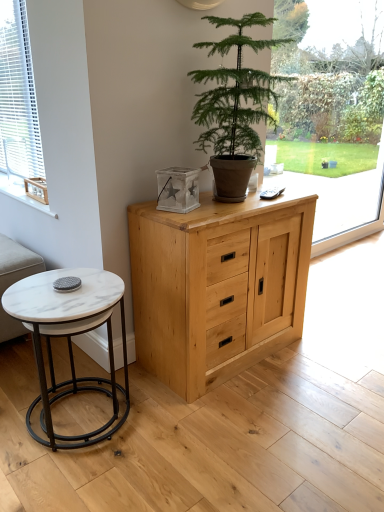
Image resolution: width=384 pixels, height=512 pixels. In order to click on empty space that is ontop of natural wood cabinet at center (from a real-world perspective) in this screenshot , I will do tap(239, 204).